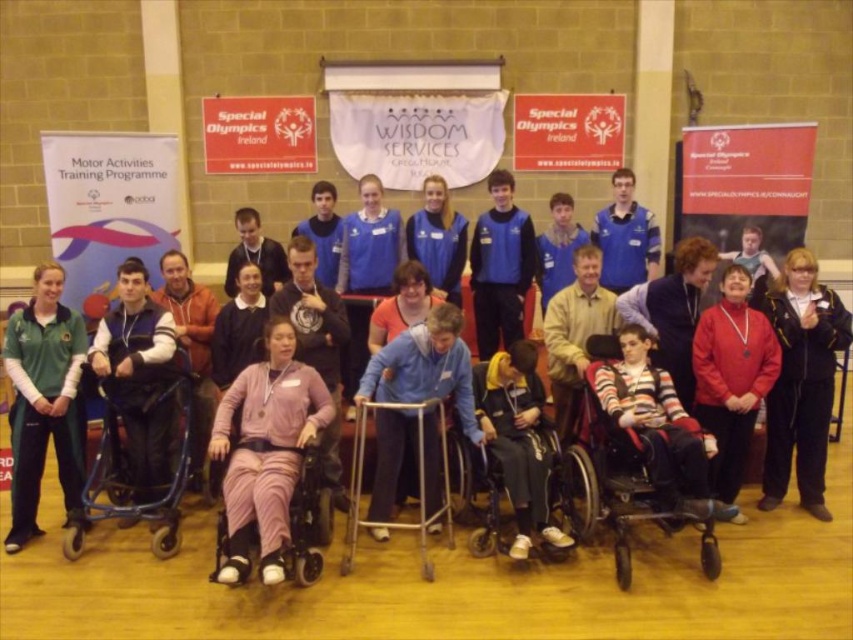
Question: Which of the following is the closest to the observer?

Choices:
 (A) (166, 445)
 (B) (479, 221)
 (C) (770, 262)
 (D) (712, 468)

Answer: (A)

Question: Which of the following is the closest to the observer?

Choices:
 (A) (41, 301)
 (B) (601, 417)
 (C) (236, 525)
 (D) (154, 397)

Answer: (C)

Question: Does matte black wheelchair at left appear on the left side of light pink fabric wheelchair at center?

Choices:
 (A) yes
 (B) no

Answer: (A)

Question: Is green fleece jacket at left thinner than blue fleece jacket at center?

Choices:
 (A) no
 (B) yes

Answer: (A)

Question: Can you confirm if blue fabric walker at center is smaller than red fleece jacket at center?

Choices:
 (A) no
 (B) yes

Answer: (A)

Question: Which object is farther from the camera taking this photo?

Choices:
 (A) blue fabric walker at center
 (B) black plastic wheelchair at center
 (C) light pink fabric wheelchair at center
 (D) black leather jacket at lower right

Answer: (D)